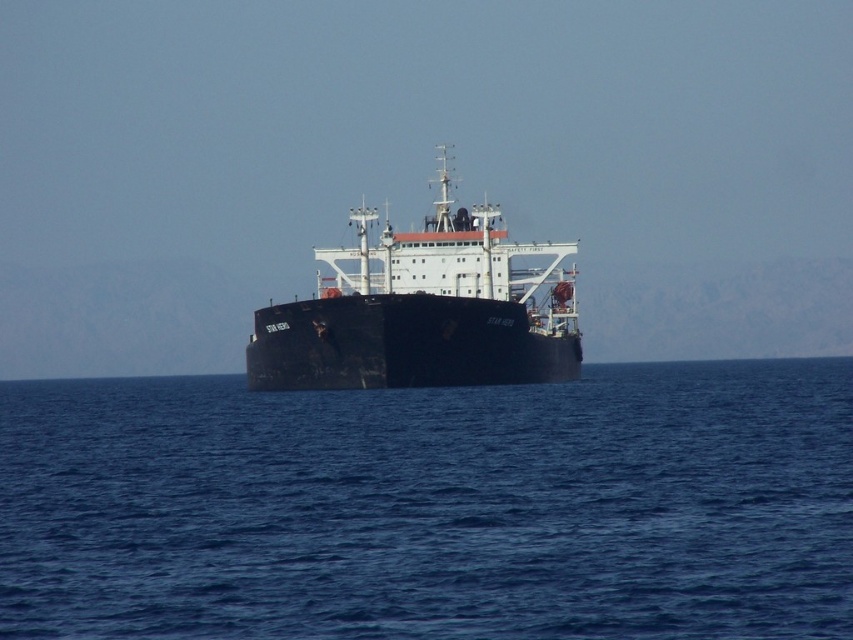
You are a sailor on the deck of the black matte ship at center. You notice the blue water at center ahead. Can you determine which one is larger in size between the two?

The blue water at center has a smaller size compared to the black matte ship at center, so the black matte ship at center is larger.

You are a sailor on a small boat and you want to know if you can safely pass between the blue water at center and the black matte ship at center. The safe passing distance for your boat is 15 meters. Can you safely navigate through this space?

The blue water at center and black matte ship at center are 15.18 meters apart, which is just over the required 15 meters safe passing distance. Therefore, you can safely navigate through this space.